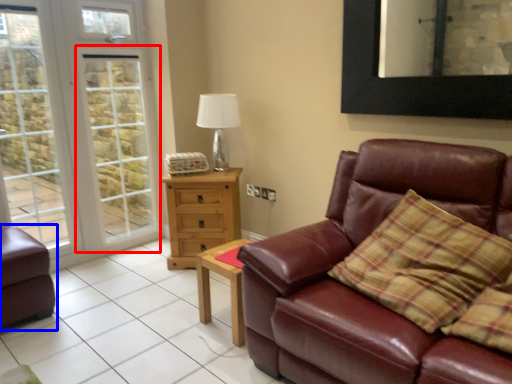
Question: Which object is further to the camera taking this photo, screen door (highlighted by a red box) or studio couch (highlighted by a blue box)?

Choices:
 (A) screen door
 (B) studio couch

Answer: (A)